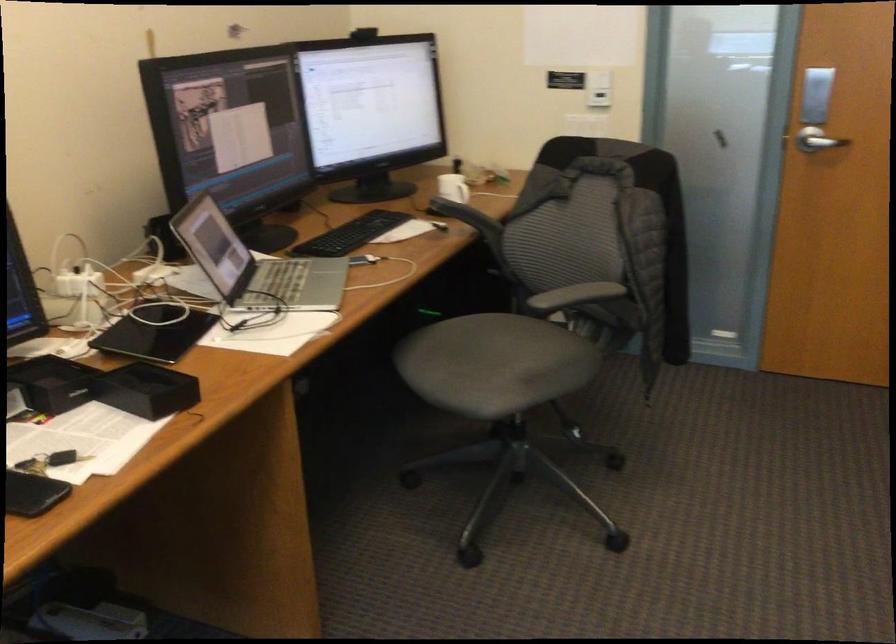
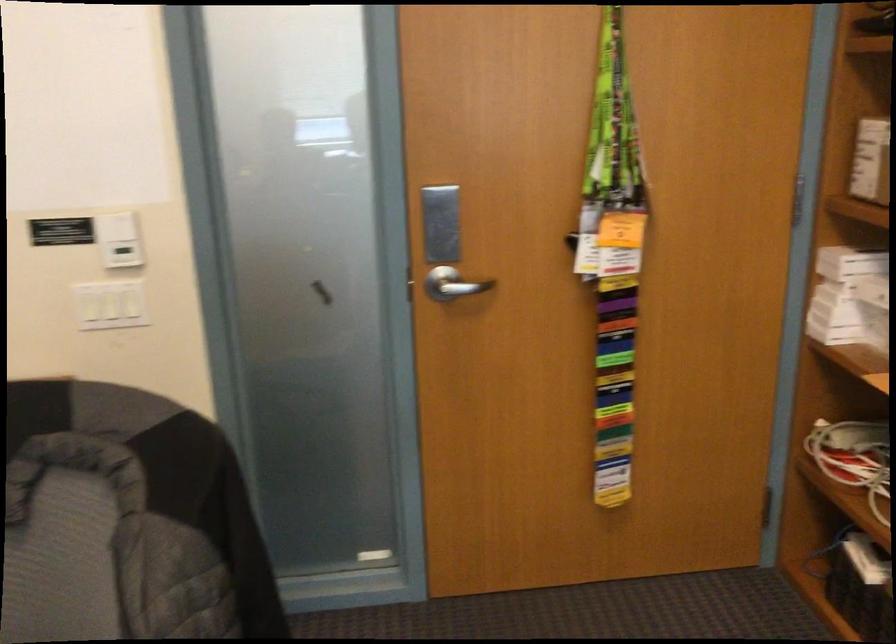
Locate, in the second image, the point that corresponds to point 591,120 in the first image.

(109, 305)